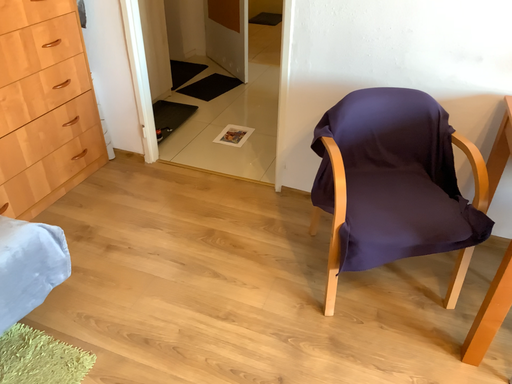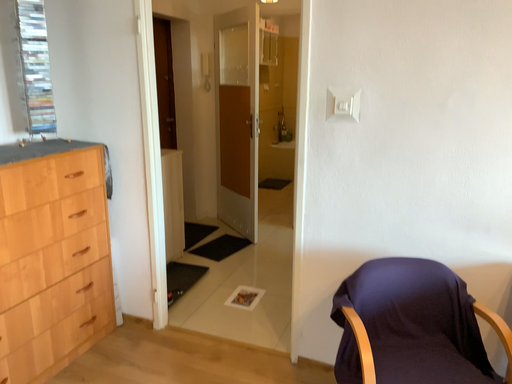
Question: How did the camera likely rotate when shooting the video?

Choices:
 (A) rotated upward
 (B) rotated downward

Answer: (A)